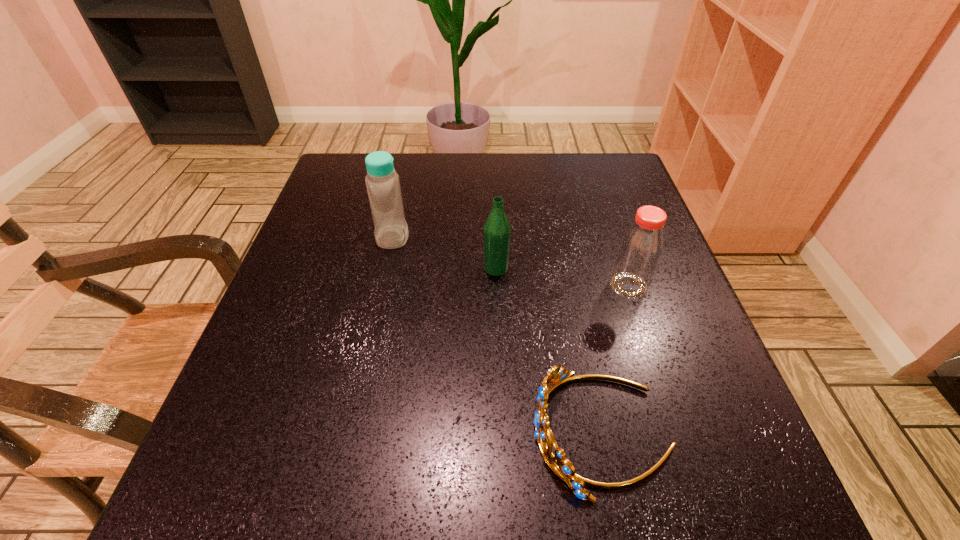
Where is `vacant space situated 0.190m on the front-facing side of the tiara`? This screenshot has height=540, width=960. vacant space situated 0.190m on the front-facing side of the tiara is located at coordinates (406, 433).

Where is `blank space located on the front-facing side of the tiara`? The height and width of the screenshot is (540, 960). blank space located on the front-facing side of the tiara is located at coordinates (452, 433).

Where is `object that is at the near edge`? object that is at the near edge is located at coordinates (560, 465).

Where is `bottle that is at the right edge`? bottle that is at the right edge is located at coordinates (641, 246).

At what (x,y) coordinates should I click in order to perform the action: click on tiara present at the right edge. Please return your answer as a coordinate pair (x, y). This screenshot has width=960, height=540. Looking at the image, I should click on (560, 465).

The image size is (960, 540). Find the location of `object present at the near right corner`. object present at the near right corner is located at coordinates (560, 465).

You are a GUI agent. You are given a task and a screenshot of the screen. Output one action in this format:
    pyautogui.click(x=<x>, y=<y>)
    Task: Click on the free space at the far edge
    The height and width of the screenshot is (540, 960).
    Given the screenshot: What is the action you would take?
    pyautogui.click(x=450, y=170)

Find the location of a particular element. The width and height of the screenshot is (960, 540). free space at the near edge of the desktop is located at coordinates (430, 466).

Locate an element on the screen. This screenshot has width=960, height=540. vacant area at the left edge of the desktop is located at coordinates (300, 346).

The width and height of the screenshot is (960, 540). In the image, there is a desktop. What are the coordinates of `free space at the right edge` in the screenshot? It's located at (611, 217).